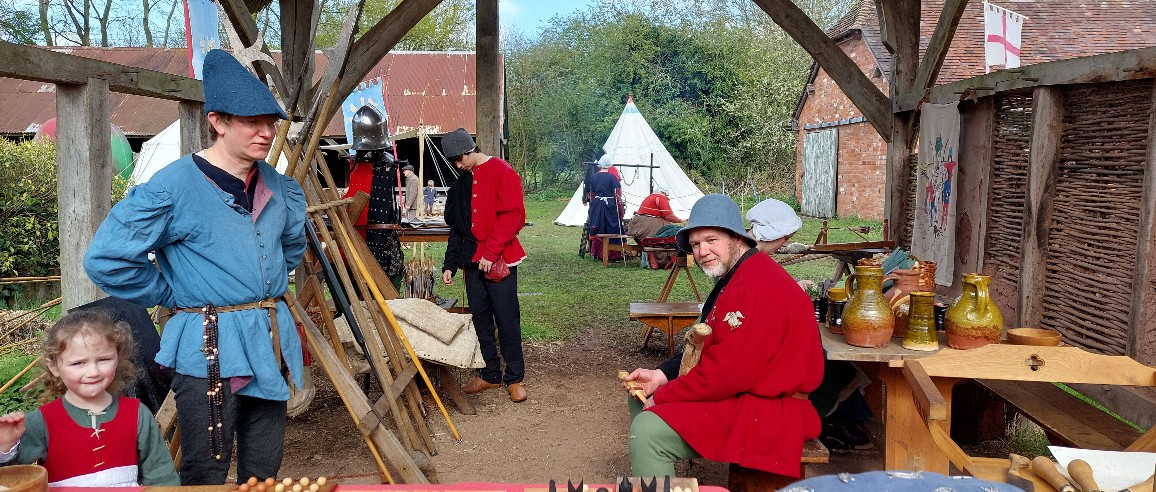
Image resolution: width=1156 pixels, height=492 pixels. What are the coordinates of `wood table, tan` in the screenshot? It's located at [x=1013, y=356].